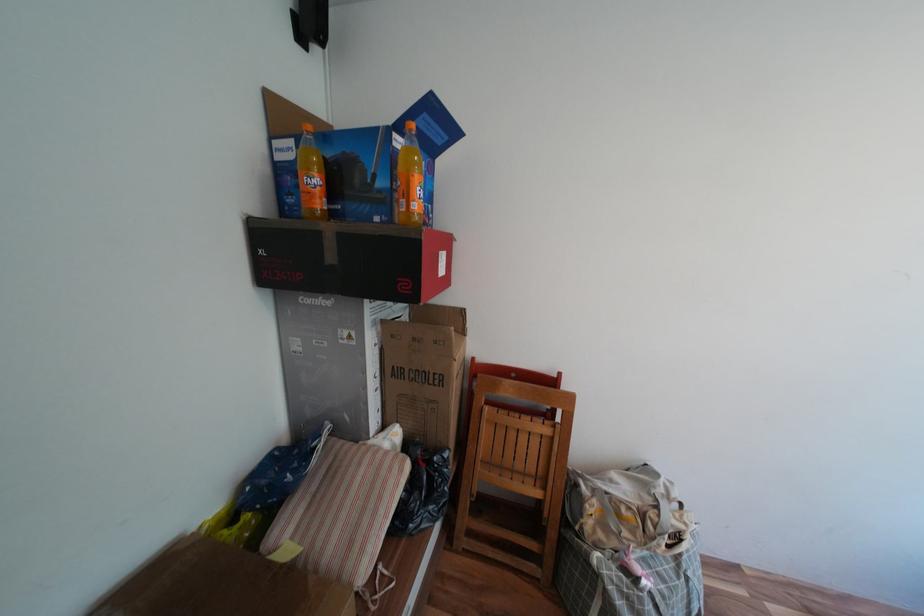
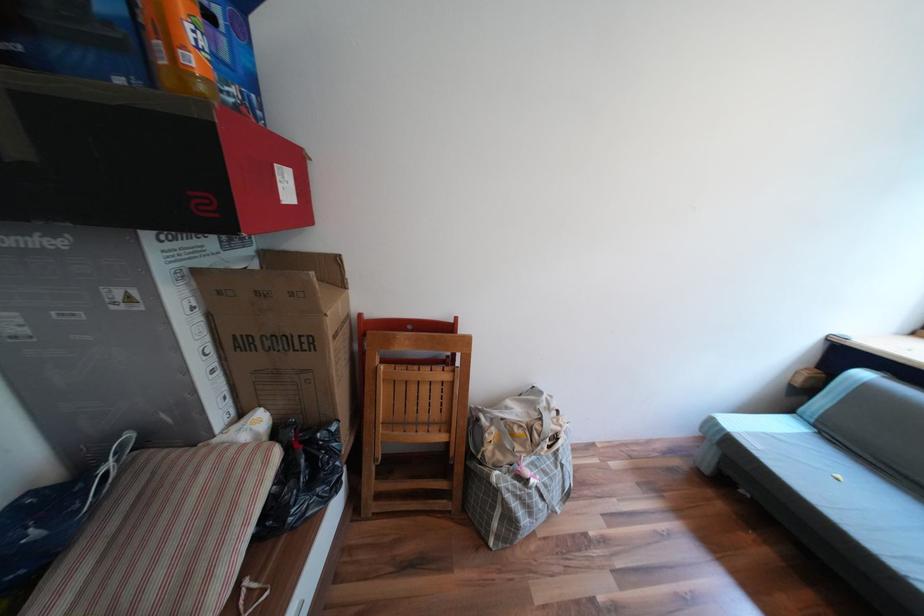
The point at (424, 206) is marked in the first image. Where is the corresponding point in the second image?

(201, 61)